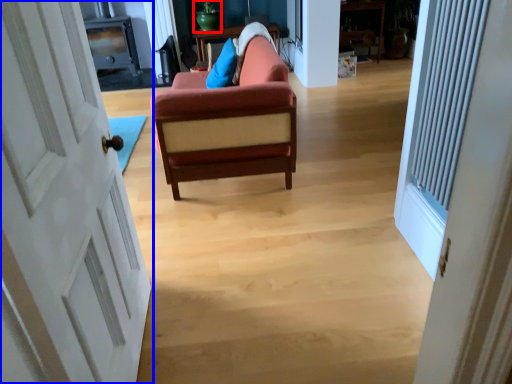
Question: Among these objects, which one is farthest to the camera, teal (highlighted by a red box) or door (highlighted by a blue box)?

Choices:
 (A) teal
 (B) door

Answer: (A)